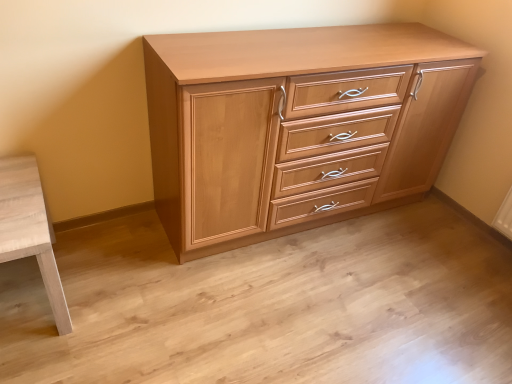
Question: Is point (338, 168) closer or farther from the camera than point (5, 175)?

Choices:
 (A) farther
 (B) closer

Answer: (A)

Question: Is light wood chest of drawers at center situated inside light wood table at lower left or outside?

Choices:
 (A) inside
 (B) outside

Answer: (B)

Question: Is light wood chest of drawers at center in front of or behind light wood table at lower left in the image?

Choices:
 (A) front
 (B) behind

Answer: (B)

Question: Considering the positions of light wood table at lower left and light wood chest of drawers at center in the image, is light wood table at lower left taller or shorter than light wood chest of drawers at center?

Choices:
 (A) short
 (B) tall

Answer: (A)

Question: Considering their positions, is light wood table at lower left located in front of or behind light wood chest of drawers at center?

Choices:
 (A) behind
 (B) front

Answer: (B)

Question: From the image's perspective, is light wood table at lower left positioned above or below light wood chest of drawers at center?

Choices:
 (A) above
 (B) below

Answer: (B)

Question: Considering the positions of light wood table at lower left and light wood chest of drawers at center in the image, is light wood table at lower left wider or thinner than light wood chest of drawers at center?

Choices:
 (A) thin
 (B) wide

Answer: (B)